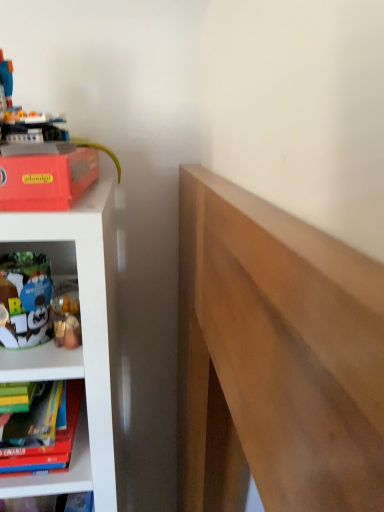
Question: Considering the relative sizes of plastic toy robot at upper left, the 2th toy in the bottom-to-top sequence, and matte red paperback book at upper left in the image provided, is plastic toy robot at upper left, the 2th toy in the bottom-to-top sequence, shorter than matte red paperback book at upper left?

Choices:
 (A) no
 (B) yes

Answer: (A)

Question: From a real-world perspective, is plastic toy robot at upper left, arranged as the first toy when viewed from the top, beneath matte red paperback book at upper left?

Choices:
 (A) yes
 (B) no

Answer: (B)

Question: From the image's perspective, would you say plastic toy robot at upper left, the 2th toy in the bottom-to-top sequence, is shown under matte red paperback book at upper left?

Choices:
 (A) no
 (B) yes

Answer: (A)

Question: Is plastic toy robot at upper left, arranged as the first toy when viewed from the top, directly adjacent to matte red paperback book at upper left?

Choices:
 (A) yes
 (B) no

Answer: (A)

Question: Does plastic toy robot at upper left, arranged as the first toy when viewed from the top, turn towards matte red paperback book at upper left?

Choices:
 (A) no
 (B) yes

Answer: (A)

Question: Considering their positions, is matte red paperback book at upper left located in front of or behind plastic toy robot at upper left, arranged as the first toy when viewed from the top?

Choices:
 (A) front
 (B) behind

Answer: (A)

Question: From the image's perspective, is matte red paperback book at upper left positioned above or below plastic toy robot at upper left, arranged as the first toy when viewed from the top?

Choices:
 (A) above
 (B) below

Answer: (B)

Question: Is matte red paperback book at upper left wider or thinner than plastic toy robot at upper left, arranged as the first toy when viewed from the top?

Choices:
 (A) thin
 (B) wide

Answer: (A)

Question: Is point (23, 167) positioned closer to the camera than point (8, 99)?

Choices:
 (A) farther
 (B) closer

Answer: (B)

Question: In terms of width, does matte red paperback book at upper left look wider or thinner when compared to white plush toy at lower left, which is counted as the 1th toy, starting from the bottom?

Choices:
 (A) wide
 (B) thin

Answer: (A)

Question: From a real-world perspective, is matte red paperback book at upper left above or below white plush toy at lower left, the 2th toy from the top?

Choices:
 (A) above
 (B) below

Answer: (A)

Question: In terms of height, does matte red paperback book at upper left look taller or shorter compared to white plush toy at lower left, the 2th toy from the top?

Choices:
 (A) short
 (B) tall

Answer: (A)

Question: From the image's perspective, is matte red paperback book at upper left positioned above or below white plush toy at lower left, the 2th toy from the top?

Choices:
 (A) below
 (B) above

Answer: (B)

Question: Is plastic toy robot at upper left, the 2th toy in the bottom-to-top sequence, bigger or smaller than white plush toy at lower left, the 2th toy from the top?

Choices:
 (A) big
 (B) small

Answer: (A)

Question: From the image's perspective, relative to white plush toy at lower left, which is counted as the 1th toy, starting from the bottom, is plastic toy robot at upper left, arranged as the first toy when viewed from the top, above or below?

Choices:
 (A) above
 (B) below

Answer: (A)